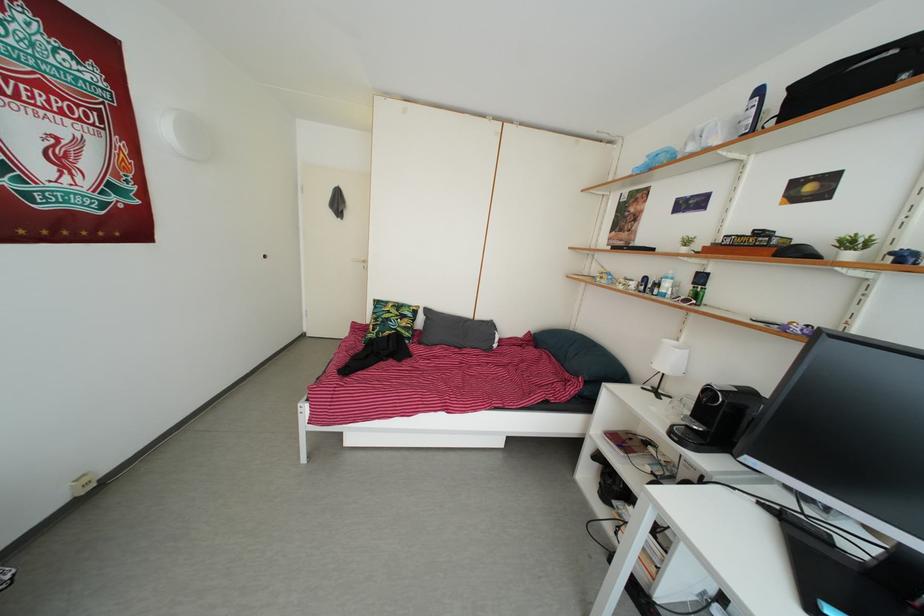
Where would you sit the bed sitting surface? Please return your answer as a coordinate pair (x, y).

(441, 384)